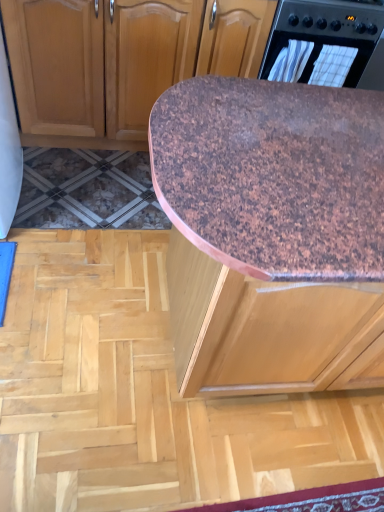
Question: Is black plastic oven at upper right looking in the opposite direction of brown speckled plywood at center?

Choices:
 (A) yes
 (B) no

Answer: (B)

Question: Is black plastic oven at upper right positioned in front of brown speckled plywood at center?

Choices:
 (A) no
 (B) yes

Answer: (A)

Question: Is black plastic oven at upper right not within brown speckled plywood at center?

Choices:
 (A) no
 (B) yes

Answer: (B)

Question: Is brown speckled plywood at center located within black plastic oven at upper right?

Choices:
 (A) yes
 (B) no

Answer: (B)

Question: Considering the relative sizes of black plastic oven at upper right and brown speckled plywood at center in the image provided, is black plastic oven at upper right thinner than brown speckled plywood at center?

Choices:
 (A) yes
 (B) no

Answer: (A)

Question: Is black plastic oven at upper right to the left of brown speckled plywood at center from the viewer's perspective?

Choices:
 (A) no
 (B) yes

Answer: (A)

Question: Is brown speckled granite countertop at center turned away from black plastic oven at upper right?

Choices:
 (A) no
 (B) yes

Answer: (B)

Question: Is the surface of brown speckled granite countertop at center in direct contact with black plastic oven at upper right?

Choices:
 (A) yes
 (B) no

Answer: (B)

Question: From a real-world perspective, does brown speckled granite countertop at center stand above black plastic oven at upper right?

Choices:
 (A) yes
 (B) no

Answer: (B)

Question: Does brown speckled granite countertop at center have a greater height compared to black plastic oven at upper right?

Choices:
 (A) yes
 (B) no

Answer: (A)

Question: Considering the relative sizes of brown speckled granite countertop at center and black plastic oven at upper right in the image provided, is brown speckled granite countertop at center shorter than black plastic oven at upper right?

Choices:
 (A) yes
 (B) no

Answer: (B)

Question: Is brown speckled granite countertop at center completely or partially outside of black plastic oven at upper right?

Choices:
 (A) no
 (B) yes

Answer: (B)

Question: Is brown speckled plywood at center inside brown speckled granite countertop at center?

Choices:
 (A) yes
 (B) no

Answer: (B)